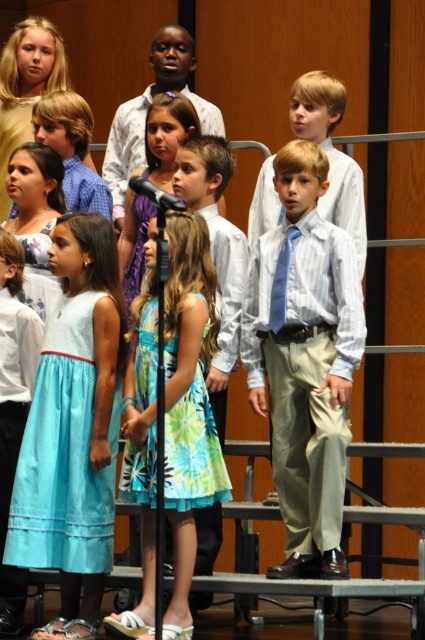
Does light blue striped shirt at center have a greater width compared to blue satin tie at center?

Yes.

Is light blue striped shirt at center positioned behind blue satin tie at center?

No, light blue striped shirt at center is in front of blue satin tie at center.

You are a GUI agent. You are given a task and a screenshot of the screen. Output one action in this format:
    pyautogui.click(x=<x>, y=<y>)
    Task: Click on the light blue striped shirt at center
    This screenshot has width=425, height=640.
    Given the screenshot: What is the action you would take?
    pyautogui.click(x=305, y=358)

This screenshot has width=425, height=640. I want to click on light blue striped shirt at center, so click(x=305, y=358).

Which is in front, point (8, 276) or point (138, 176)?

Point (8, 276) is in front.

The image size is (425, 640). What do you see at coordinates (14, 410) in the screenshot? I see `light blue dress at center` at bounding box center [14, 410].

At what (x,y) coordinates should I click in order to perform the action: click on light blue dress at center. Please return your answer as a coordinate pair (x, y). Image resolution: width=425 pixels, height=640 pixels. Looking at the image, I should click on [14, 410].

Is light blue striped shirt at center wider than black plastic microphone at center?

Yes.

In the scene shown: Does light blue striped shirt at center appear on the left side of black plastic microphone at center?

No, light blue striped shirt at center is not to the left of black plastic microphone at center.

Locate an element on the screen. The image size is (425, 640). light blue striped shirt at center is located at coordinates (305, 358).